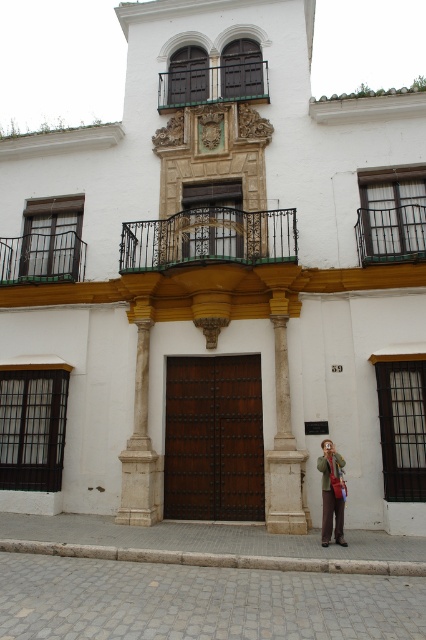
You are an architect inspecting the building facade. You notice the dark wood balcony at upper center and the rustic wrought iron balcony at upper right. Which balcony is positioned higher on the building?

The dark wood balcony at upper center is positioned higher on the building than the rustic wrought iron balcony at upper right because it is located above it.

You are an architect examining the building facade. You need to place a new decorative element between the white marble column at center and the dark wood balcony at upper center. Based on their positions, which object is closer to the center of the facade?

The white marble column at center is closer to the center of the facade because it is positioned to the left of the dark wood balcony at upper center, meaning the column is nearer to the central axis.

You are standing in front of the traditional Spanish building and want to take a closer look at the dark wood balcony at upper center and the rustic wrought iron balcony at upper right. Which balcony will appear closer to you when you first look at the building?

The dark wood balcony at upper center appears closer to you because it is positioned further to the viewer than the rustic wrought iron balcony at upper right, making it seem nearer in perspective.